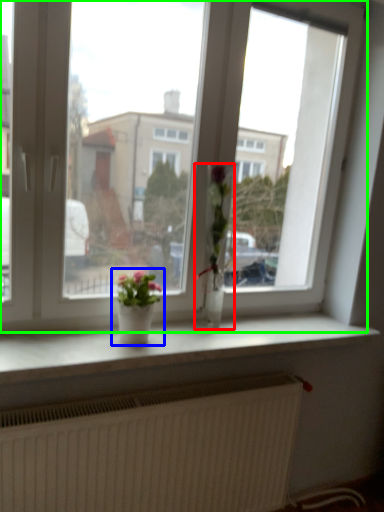
Question: Based on their relative distances, which object is nearer to houseplant (highlighted by a red box)? Choose from houseplant (highlighted by a blue box) and window (highlighted by a green box).

Choices:
 (A) houseplant
 (B) window

Answer: (B)